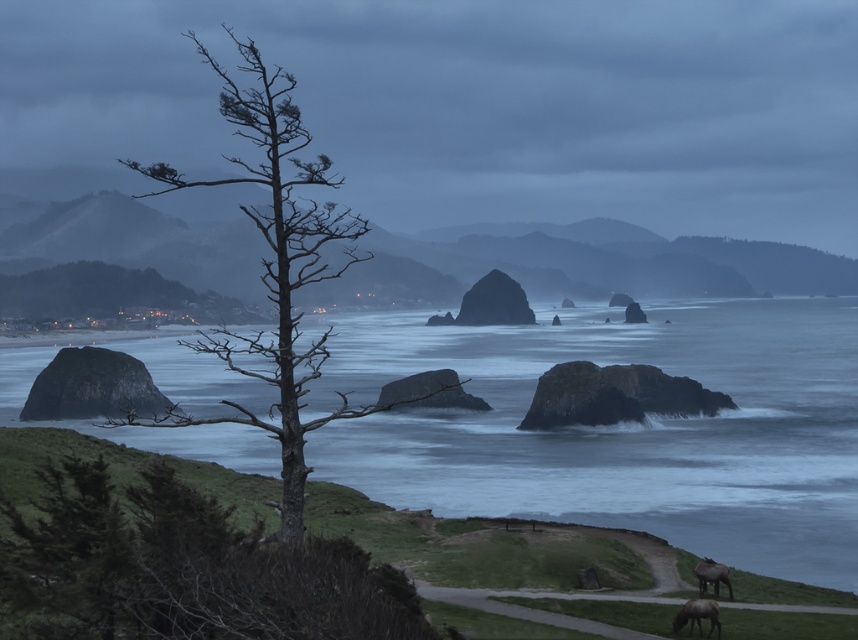
Who is more forward, (523, 506) or (272, 280)?

Point (272, 280)

Which is more to the right, blue water at center or brown rough tree at center-left?

blue water at center is more to the right.

Does point (855, 540) lie in front of point (311, 228)?

No, it is not.

Identify the location of blue water at center. The width and height of the screenshot is (858, 640). (621, 428).

Which of these two, brown rough tree at center-left or brown furry horse at lower right, stands taller?

brown rough tree at center-left

Who is positioned more to the right, brown rough tree at center-left or brown furry horse at lower right?

Positioned to the right is brown furry horse at lower right.

Is point (288, 100) in front of point (717, 634)?

Yes, it is in front of point (717, 634).

Find the location of a particular element. brown rough tree at center-left is located at coordinates (275, 264).

Which is more to the left, bare wood tree at left or brown rough tree at center-left?

brown rough tree at center-left is more to the left.

Does bare wood tree at left lie in front of brown rough tree at center-left?

Yes, bare wood tree at left is in front of brown rough tree at center-left.

Who is more distant from viewer, (142, 579) or (207, 58)?

Point (207, 58)

Identify the location of bare wood tree at left. (180, 568).